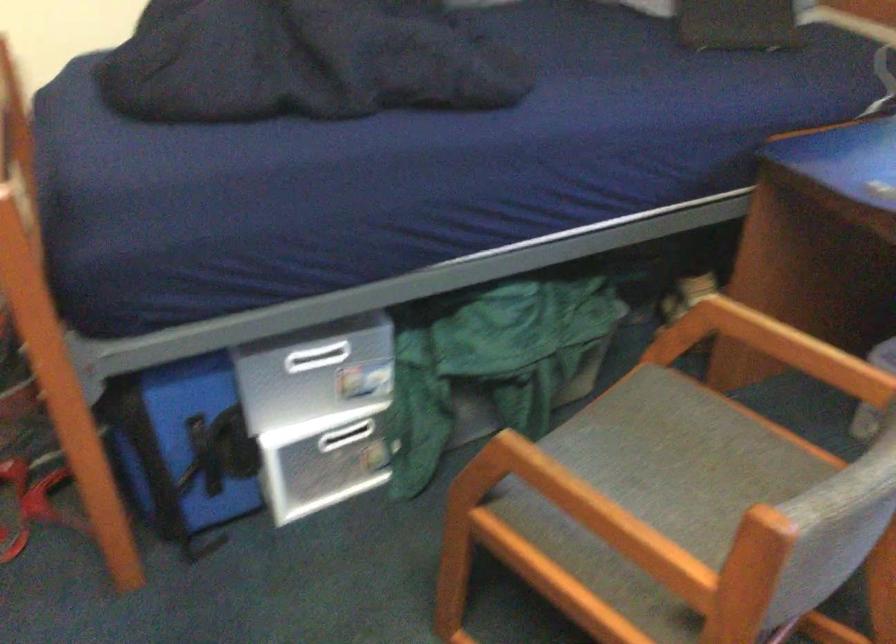
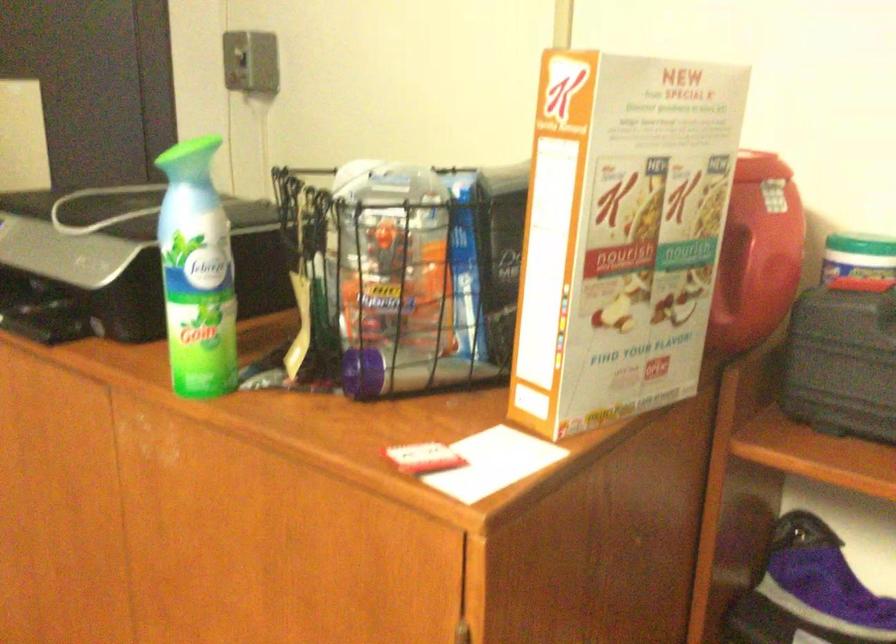
First-person continuous shooting, in which direction is the camera rotating?

The camera rotated toward left-down.